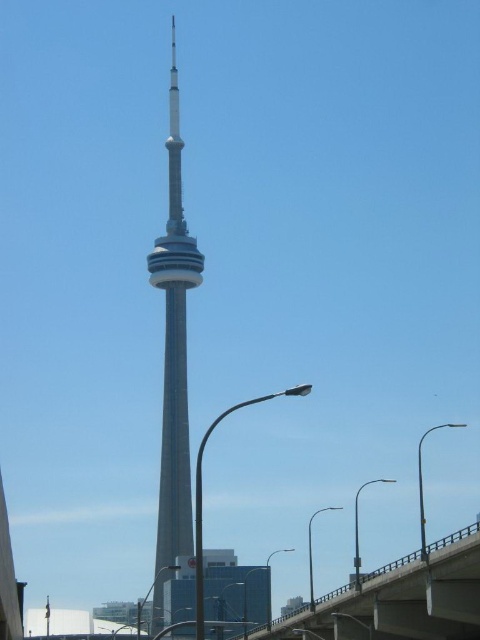
You are a city planner evaluating the width of structures for a new project. You observe the metallic gray bridge at lower center and the smooth gray tower at center in the image. Which structure has a greater width?

The metallic gray bridge at lower center might be wider than smooth gray tower at center according to the description.

You are a city planner assessing the CN Tower area. You observe the metallic gray bridge at lower center and the smooth gray tower at center. Which structure occupies a larger physical space in the image?

The metallic gray bridge at lower center is bigger than the smooth gray tower at center, so the metallic gray bridge at lower center occupies a larger physical space in the image.